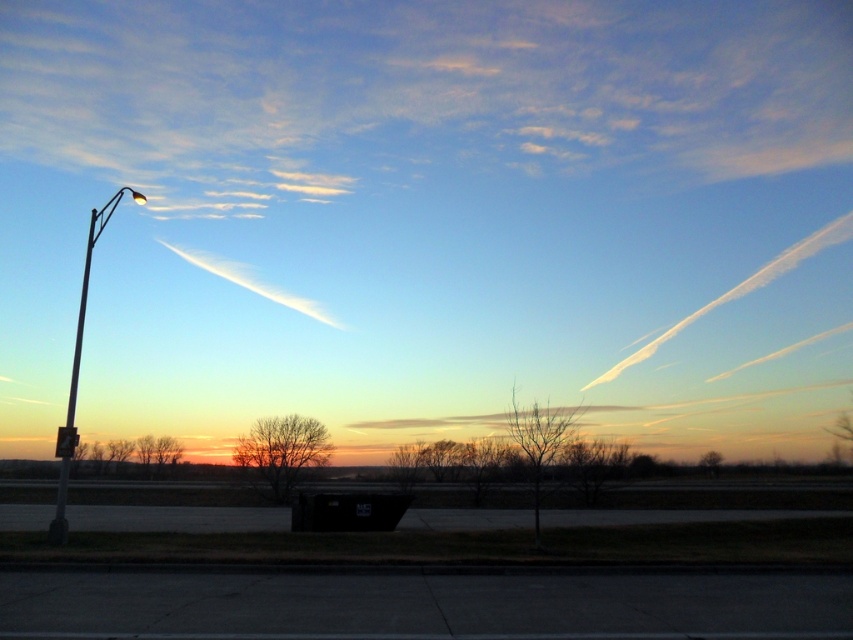
You are standing at the camera position and want to pick up an object. There are two points marked in the image, point 1 at coordinates point (279, 296) and point 2 at coordinates point (631, 408). Which point is closer to you?

Point (279, 296) is closer to the camera than point (631, 408).

You are an astronomer observing the sky and notice two clouds in the image. Which cloud is positioned higher in the sky between the white cotton cloud at upper right and the translucent white cloud at center?

The white cotton cloud at upper right is positioned higher in the sky than the translucent white cloud at center.